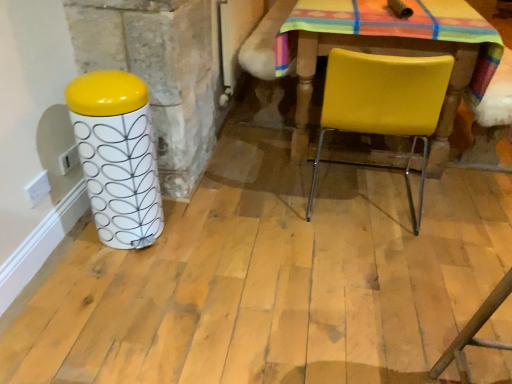
Locate an element on the screen. The image size is (512, 384). vacant space in yellow leather chair at center (from a real-world perspective) is located at coordinates (359, 199).